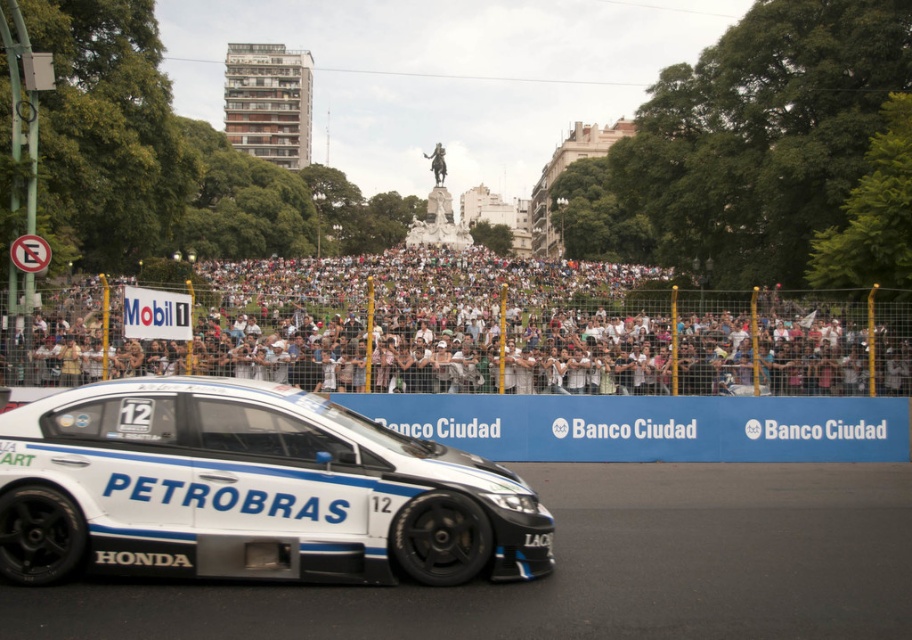
Question: Among these points, which one is nearest to the camera?

Choices:
 (A) (597, 547)
 (B) (268, 556)

Answer: (B)

Question: Can you confirm if white crowd at upper center is thinner than white smooth asphalt at center?

Choices:
 (A) no
 (B) yes

Answer: (A)

Question: Which of the following is the closest to the observer?

Choices:
 (A) (838, 536)
 (B) (228, 561)

Answer: (B)

Question: Does white crowd at upper center come behind white glossy car at center?

Choices:
 (A) yes
 (B) no

Answer: (A)

Question: Which point appears farthest from the camera in this image?

Choices:
 (A) pos(48,397)
 (B) pos(201,314)

Answer: (B)

Question: Does white crowd at upper center appear under white smooth asphalt at center?

Choices:
 (A) no
 (B) yes

Answer: (A)